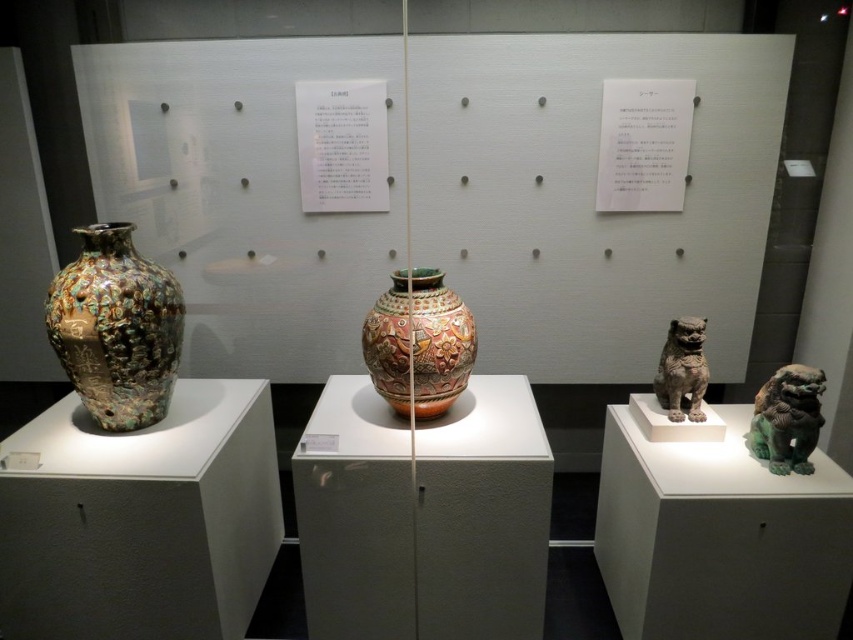
You are a visitor standing in front of the museum display. You want to take a photo of the bronze statue at center right without the multicolored glazed vase at center appearing in the background. Is this possible given their positions?

The multicolored glazed vase at center is in front of the bronze statue at center right, so it will block the view of the bronze statue at center right. Therefore, you cannot take a photo of the bronze statue at center right without the multicolored glazed vase at center appearing in the background.

You are standing in the museum and want to touch the multicolored glazed vase at center. The museum has a rule that you must not touch any artifacts within 1 meter of their edges. Given that the point you can safely touch is at coordinates point (419, 342), can you safely touch the multicolored glazed vase at center at that point?

The point (419, 342) is on the multicolored glazed vase at center, so touching it at that point would violate the museum rule since it is directly on the artifact, which is within the 1 meter restriction from its edges.

You are a museum visitor holding a small backpack. You want to place your backpack on the floor between the multicolored glazed vase at center and the bronze statue at center right without touching either artifact. Is there enough space between them?

The multicolored glazed vase at center is bigger than the bronze statue at center right, but the question of space between them isn